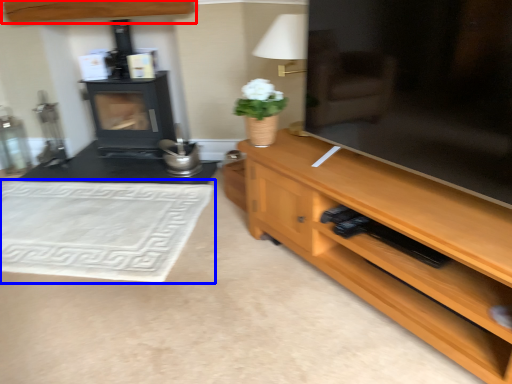
Question: Which of the following is the closest to the observer, cabinetry (highlighted by a red box) or mat (highlighted by a blue box)?

Choices:
 (A) cabinetry
 (B) mat

Answer: (B)